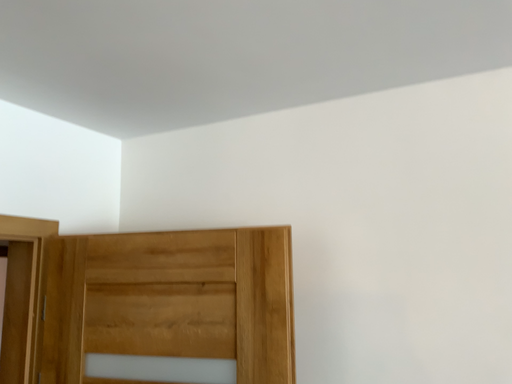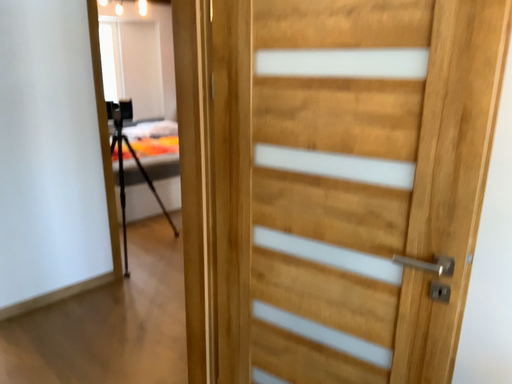
Question: How did the camera likely rotate when shooting the video?

Choices:
 (A) rotated upward
 (B) rotated downward

Answer: (B)